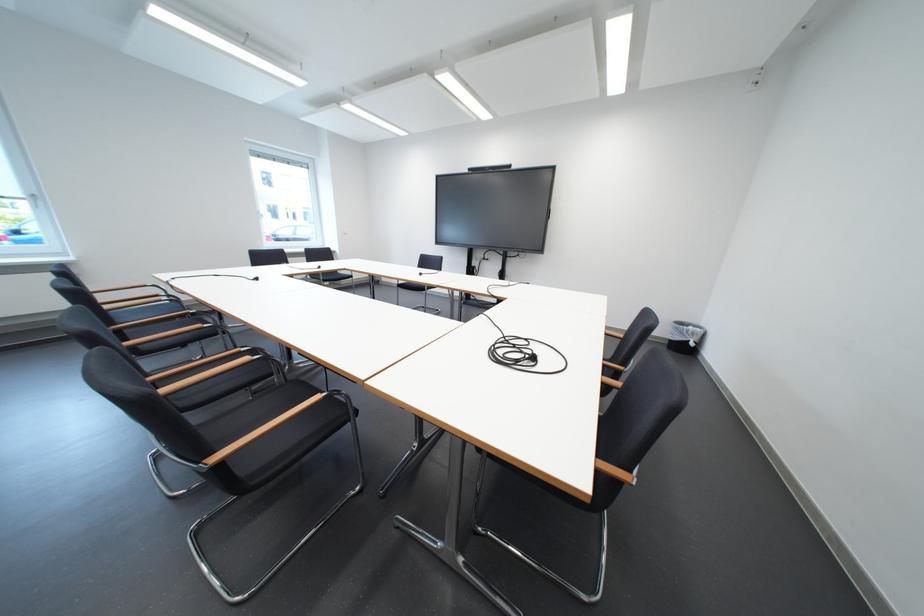
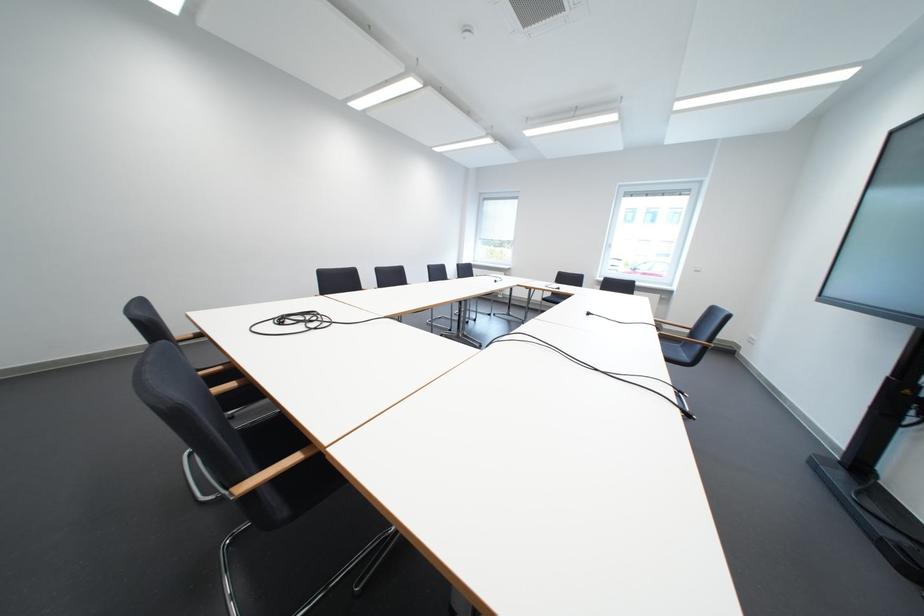
The point at (432, 276) is marked in the first image. Where is the corresponding point in the second image?

(601, 315)